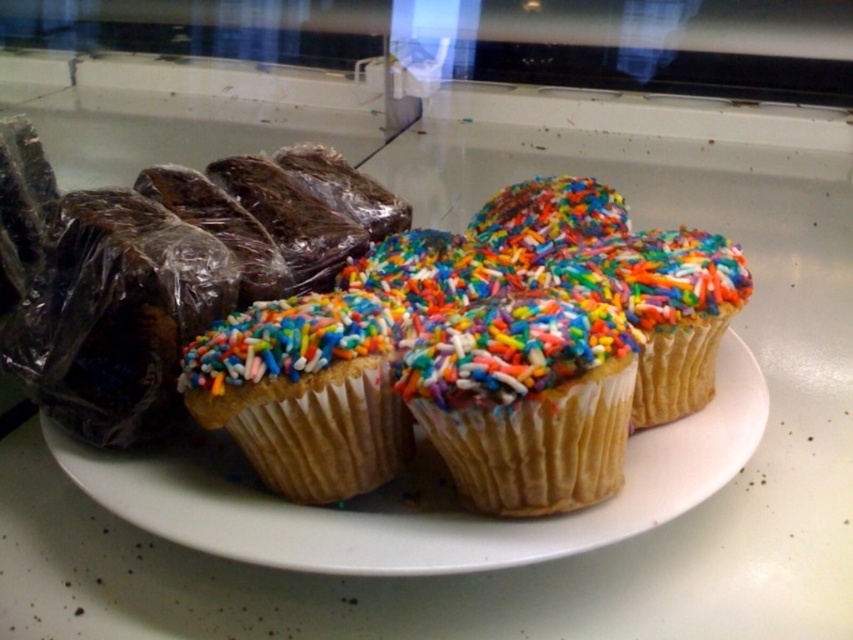
You are standing in front of the plate of cupcakes and need to place a small decorative ribbon exactly at the center of the plate. The plate has a diameter of 30 cm. Can you determine the coordinates where you should place the ribbon based on the position of the multicolored sprinkles cupcake at center?

The multicolored sprinkles cupcake at center is located at coordinates point [525,401], so the ribbon should be placed at those coordinates to be at the center of the plate.

You are standing in front of the plate of cupcakes on the countertop. There is a wrapped item to the left of the cupcakes. If you want to place a new cupcake exactly where the white paper cupcake with colorful sprinkles at center is currently located, where should you place it?

You should place the new cupcake at the coordinates point [561,340] where the white paper cupcake with colorful sprinkles at center is currently located.

You need to place both the white paper cupcake with colorful sprinkles at center and the multicolored sprinkles cupcake at center into a box that can only hold items up to 10 cm in width. Which cupcake should you place first to ensure both fit?

The white paper cupcake with colorful sprinkles at center might be wider than the multicolored sprinkles cupcake at center. To ensure both fit, place the wider one first, then the narrower one.